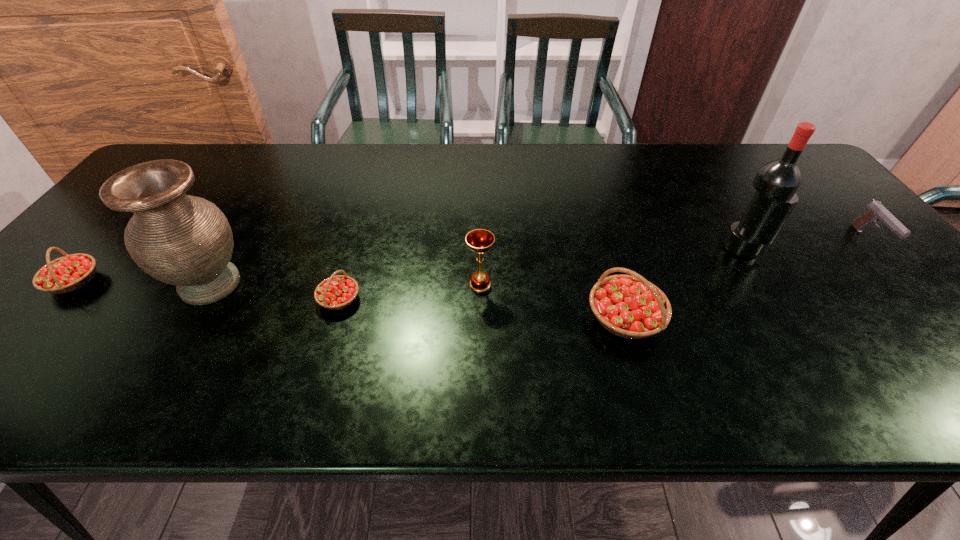
You are a GUI agent. You are given a task and a screenshot of the screen. Output one action in this format:
    pyautogui.click(x=<x>, y=<y>)
    Task: Click on the object that is at the right edge
    This screenshot has height=540, width=960.
    Given the screenshot: What is the action you would take?
    pyautogui.click(x=875, y=211)

The image size is (960, 540). I want to click on free space at the far edge, so click(x=232, y=151).

In the image, there is a desktop. In order to click on free region at the near edge in this screenshot , I will do `click(237, 358)`.

Locate an element on the screen. The height and width of the screenshot is (540, 960). vacant area at the right edge of the desktop is located at coordinates (859, 234).

This screenshot has height=540, width=960. Identify the location of free space between the pistol and the shortest strawberry. (604, 270).

Where is `free point between the rightmost strawberry and the pistol`? The width and height of the screenshot is (960, 540). free point between the rightmost strawberry and the pistol is located at coordinates (747, 279).

Where is `free spot between the sixth shortest object and the tallest strawberry`? Image resolution: width=960 pixels, height=540 pixels. free spot between the sixth shortest object and the tallest strawberry is located at coordinates (418, 301).

Locate an element on the screen. The height and width of the screenshot is (540, 960). vacant space in between the shortest object and the fifth object from left to right is located at coordinates pos(482,308).

You are a GUI agent. You are given a task and a screenshot of the screen. Output one action in this format:
    pyautogui.click(x=<x>, y=<y>)
    Task: Click on the vacant space that is in between the rightmost object and the leftmost object
    
    Given the screenshot: What is the action you would take?
    pyautogui.click(x=471, y=261)

Where is `vacant point located between the sixth shortest object and the third object from left to right`? The width and height of the screenshot is (960, 540). vacant point located between the sixth shortest object and the third object from left to right is located at coordinates (275, 292).